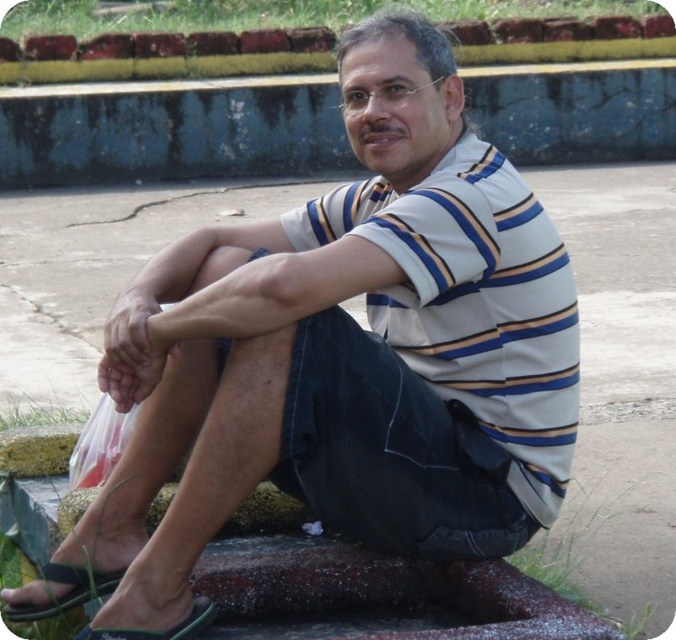
Question: Is striped cotton polo shirt at center above green fabric sandal at lower left?

Choices:
 (A) no
 (B) yes

Answer: (B)

Question: Among these objects, which one is farthest from the camera?

Choices:
 (A) striped cotton polo shirt at center
 (B) green fabric sandal at lower left

Answer: (B)

Question: Is smooth concrete curb at upper center below green fabric sandal at lower left?

Choices:
 (A) no
 (B) yes

Answer: (A)

Question: Can you confirm if striped cotton polo shirt at center is positioned to the right of smooth concrete curb at upper center?

Choices:
 (A) no
 (B) yes

Answer: (A)

Question: Which point is closer to the camera?

Choices:
 (A) green rubber sandal at lower left
 (B) striped cotton polo shirt at center
 (C) smooth concrete curb at upper center
 (D) green fabric sandal at lower left

Answer: (B)

Question: Which point is farther to the camera?

Choices:
 (A) smooth concrete curb at upper center
 (B) green rubber sandal at lower left
 (C) striped cotton polo shirt at center

Answer: (A)